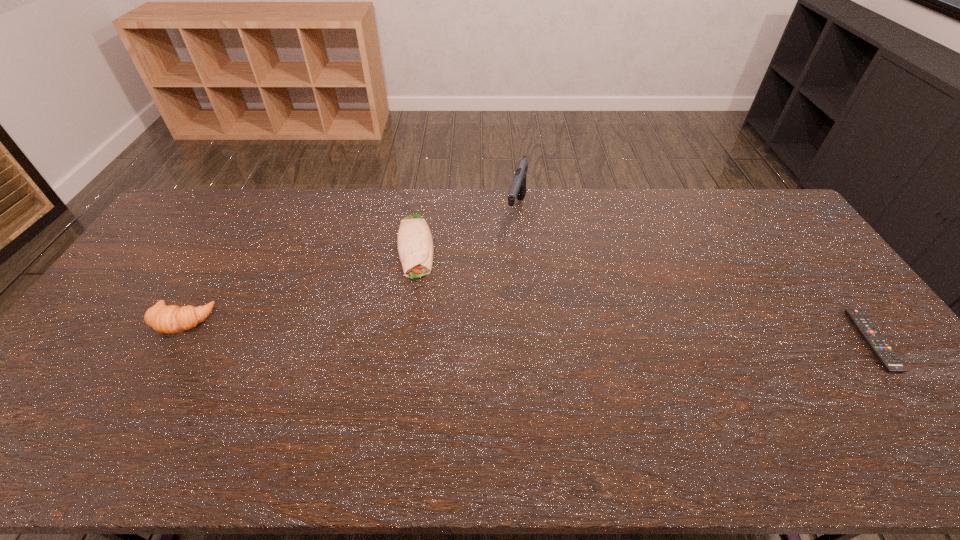
Locate an element on the screen. the second tallest object is located at coordinates (172, 319).

Find the location of a particular element. The width and height of the screenshot is (960, 540). the leftmost object is located at coordinates (172, 319).

You are a GUI agent. You are given a task and a screenshot of the screen. Output one action in this format:
    pyautogui.click(x=<x>, y=<y>)
    Task: Click on the remote control
    The image size is (960, 540).
    Given the screenshot: What is the action you would take?
    pyautogui.click(x=874, y=339)

This screenshot has width=960, height=540. In order to click on the rightmost object in this screenshot , I will do `click(874, 339)`.

Where is `the tallest object`? This screenshot has width=960, height=540. the tallest object is located at coordinates (518, 188).

The width and height of the screenshot is (960, 540). I want to click on the third object from left to right, so click(518, 188).

Locate an element on the screen. the second object from left to right is located at coordinates (415, 247).

Image resolution: width=960 pixels, height=540 pixels. What are the coordinates of `burrito` in the screenshot? It's located at coord(415,247).

At what (x,y) coordinates should I click in order to perform the action: click on blank area located on the right of the crescent roll. Please return your answer as a coordinate pair (x, y). The image size is (960, 540). Looking at the image, I should click on (253, 321).

This screenshot has height=540, width=960. In order to click on blank space located 0.150m on the left of the rightmost object in this screenshot , I will do `click(807, 341)`.